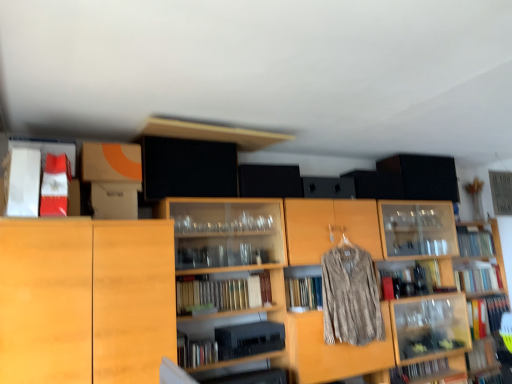
Question: Considering the relative positions of matte red book at upper left, which ranks as the sixth book in bottom-to-top order, and wooden bookshelf at center, the 2th shelf from the right, in the image provided, is matte red book at upper left, which ranks as the sixth book in bottom-to-top order, to the left of wooden bookshelf at center, the 2th shelf from the right, from the viewer's perspective?

Choices:
 (A) yes
 (B) no

Answer: (A)

Question: Does matte red book at upper left, placed as the first book when sorted from left to right, have a smaller size compared to wooden bookshelf at center, the first shelf from the left?

Choices:
 (A) yes
 (B) no

Answer: (A)

Question: Is wooden bookshelf at center, the first shelf from the left, completely or partially inside matte red book at upper left, which ranks as the sixth book in bottom-to-top order?

Choices:
 (A) no
 (B) yes

Answer: (A)

Question: Is matte red book at upper left, the first book viewed from the top, thinner than wooden bookshelf at center, the 2th shelf from the right?

Choices:
 (A) yes
 (B) no

Answer: (A)

Question: Is matte red book at upper left, which is the 6th book in right-to-left order, far from wooden bookshelf at center, the 2th shelf from the right?

Choices:
 (A) no
 (B) yes

Answer: (B)

Question: From the image's perspective, is matte red book at upper left, placed as the first book when sorted from left to right, positioned above or below hardcover book at right, which appears as the second book when ordered from the bottom?

Choices:
 (A) above
 (B) below

Answer: (A)

Question: Does point (55, 175) appear closer or farther from the camera than point (484, 332)?

Choices:
 (A) closer
 (B) farther

Answer: (A)

Question: Based on their positions, is matte red book at upper left, which ranks as the sixth book in bottom-to-top order, located to the left or right of hardcover book at right, which appears as the second book when ordered from the bottom?

Choices:
 (A) left
 (B) right

Answer: (A)

Question: Looking at the image, does matte red book at upper left, the first book when ordered from front to back, seem bigger or smaller compared to hardcover book at right, the sixth book viewed from the left?

Choices:
 (A) small
 (B) big

Answer: (B)

Question: From the image's perspective, is light wood cabinet at left located above or below hardcover book at upper right, which is counted as the fifth book, starting from the bottom?

Choices:
 (A) above
 (B) below

Answer: (B)

Question: Is light wood cabinet at left in front of or behind hardcover book at upper right, which is the 2th book in right-to-left order, in the image?

Choices:
 (A) behind
 (B) front

Answer: (B)

Question: Considering the positions of point (39, 324) and point (492, 243), is point (39, 324) closer or farther from the camera than point (492, 243)?

Choices:
 (A) farther
 (B) closer

Answer: (B)

Question: Considering the positions of light wood cabinet at left and hardcover book at upper right, which is the 2th book in right-to-left order, in the image, is light wood cabinet at left taller or shorter than hardcover book at upper right, which is the 2th book in right-to-left order,?

Choices:
 (A) tall
 (B) short

Answer: (A)

Question: Is matte red book at upper left, placed as the first book when sorted from left to right, inside the boundaries of hardcover books at center, marked as the 5th book in a right-to-left arrangement, or outside?

Choices:
 (A) inside
 (B) outside

Answer: (B)

Question: Relative to hardcover books at center, marked as the 5th book in a right-to-left arrangement, is matte red book at upper left, the first book viewed from the top, in front or behind?

Choices:
 (A) front
 (B) behind

Answer: (A)